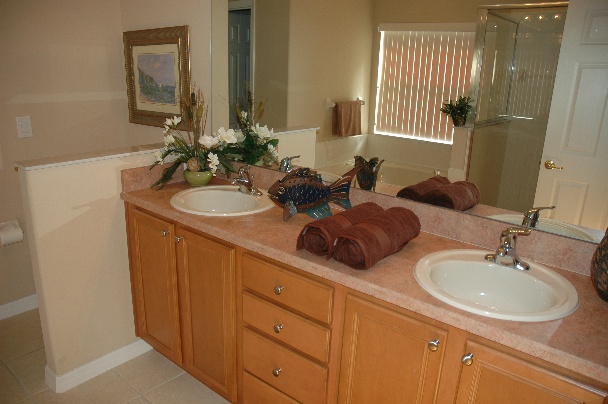
Find the location of a particular element. This screenshot has width=608, height=404. drawer is located at coordinates (314, 304), (304, 336), (298, 373), (273, 393).